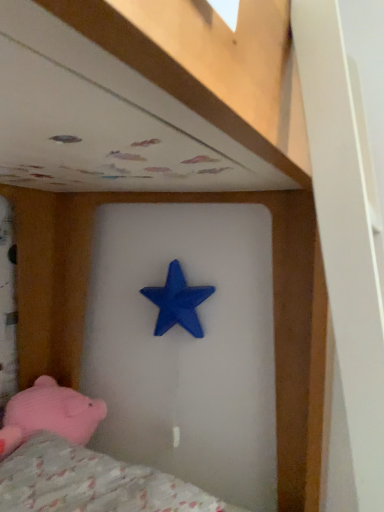
Describe the element at coordinates (49, 414) in the screenshot. I see `pink plush pig at lower left` at that location.

I want to click on blue matte star at center, so click(x=178, y=302).

I want to click on pink plush pig at lower left, so [49, 414].

Is point (191, 287) positioned behind point (108, 461)?

Yes.

Can you tell me how much blue matte star at center and fluffy pink fabric at lower left differ in facing direction?

0.65 degrees separate the facing orientations of blue matte star at center and fluffy pink fabric at lower left.

From the picture: In the image, is blue matte star at center on the left side or the right side of fluffy pink fabric at lower left?

From the image, it's evident that blue matte star at center is to the right of fluffy pink fabric at lower left.

Is blue matte star at center beside fluffy pink fabric at lower left?

No, blue matte star at center is not with fluffy pink fabric at lower left.

Where is `toy that is in front of the blue matte star at center`? The width and height of the screenshot is (384, 512). toy that is in front of the blue matte star at center is located at coordinates (49, 414).

Consider the image. Could pink plush pig at lower left be considered to be inside blue matte star at center?

No, pink plush pig at lower left is not a part of blue matte star at center.

From the picture: Is blue matte star at center not near pink plush pig at lower left?

No, blue matte star at center is not far from pink plush pig at lower left.

Which is behind, blue matte star at center or pink plush pig at lower left?

blue matte star at center is further away from the camera.

Does pink plush pig at lower left lie in front of fluffy pink fabric at lower left?

No, it is behind fluffy pink fabric at lower left.

From the picture: Is pink plush pig at lower left oriented towards fluffy pink fabric at lower left?

Yes, pink plush pig at lower left is aimed at fluffy pink fabric at lower left.

Is pink plush pig at lower left shorter than fluffy pink fabric at lower left?

Incorrect, the height of pink plush pig at lower left does not fall short of that of fluffy pink fabric at lower left.

From a real-world perspective, is pink plush pig at lower left above or below fluffy pink fabric at lower left?

In terms of real-world spatial position, pink plush pig at lower left is above fluffy pink fabric at lower left.

From a real-world perspective, is fluffy pink fabric at lower left positioned above or below pink plush pig at lower left?

fluffy pink fabric at lower left is below pink plush pig at lower left.

Can you confirm if fluffy pink fabric at lower left is bigger than pink plush pig at lower left?

Indeed, fluffy pink fabric at lower left has a larger size compared to pink plush pig at lower left.

Between point (211, 508) and point (81, 430), which one is positioned behind?

Point (81, 430)

What's the angular difference between pink plush pig at lower left and blue matte star at center's facing directions?

The angle between the facing direction of pink plush pig at lower left and the facing direction of blue matte star at center is 86.7 degrees.

Consider the image. Is pink plush pig at lower left far from blue matte star at center?

Actually, pink plush pig at lower left and blue matte star at center are a little close together.

Looking at this image, is pink plush pig at lower left in front of or behind blue matte star at center in the image?

pink plush pig at lower left is in front of blue matte star at center.

Visually, is pink plush pig at lower left positioned to the left or to the right of blue matte star at center?

Clearly, pink plush pig at lower left is on the left of blue matte star at center in the image.

From the image's perspective, is fluffy pink fabric at lower left under blue matte star at center?

Yes, from the image's perspective, fluffy pink fabric at lower left is below blue matte star at center.

How many degrees apart are the facing directions of fluffy pink fabric at lower left and blue matte star at center?

They differ by 0.65 degrees in their facing directions.

Can we say fluffy pink fabric at lower left lies outside blue matte star at center?

Absolutely, fluffy pink fabric at lower left is external to blue matte star at center.

Where is `starfish that is above the fluffy pink fabric at lower left (from the image's perspective)`? The width and height of the screenshot is (384, 512). starfish that is above the fluffy pink fabric at lower left (from the image's perspective) is located at coordinates (178, 302).

This screenshot has width=384, height=512. What are the coordinates of `toy below the blue matte star at center (from a real-world perspective)` in the screenshot? It's located at (49, 414).

From the picture: When comparing their distances from fluffy pink fabric at lower left, does blue matte star at center or pink plush pig at lower left seem closer?

pink plush pig at lower left.

Estimate the real-world distances between objects in this image. Which object is further from blue matte star at center, pink plush pig at lower left or fluffy pink fabric at lower left?

Based on the image, fluffy pink fabric at lower left appears to be further to blue matte star at center.

Consider the image. Considering their positions, is blue matte star at center positioned further to pink plush pig at lower left than fluffy pink fabric at lower left?

blue matte star at center is further to pink plush pig at lower left.

Based on their spatial positions, is fluffy pink fabric at lower left or blue matte star at center further from pink plush pig at lower left?

blue matte star at center lies further to pink plush pig at lower left than the other object.

From the picture: Estimate the real-world distances between objects in this image. Which object is closer to fluffy pink fabric at lower left, pink plush pig at lower left or blue matte star at center?

Among the two, pink plush pig at lower left is located nearer to fluffy pink fabric at lower left.

Looking at the image, which one is located further to blue matte star at center, fluffy pink fabric at lower left or pink plush pig at lower left?

The object further to blue matte star at center is fluffy pink fabric at lower left.

Locate an element on the screen. The height and width of the screenshot is (512, 384). toy positioned between fluffy pink fabric at lower left and blue matte star at center from near to far is located at coordinates (49, 414).